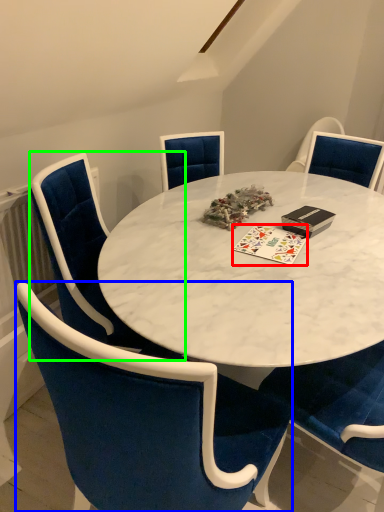
Question: Considering the real-world distances, which object is closest to card game (highlighted by a red box)? chair (highlighted by a blue box) or chair (highlighted by a green box).

Choices:
 (A) chair
 (B) chair

Answer: (B)